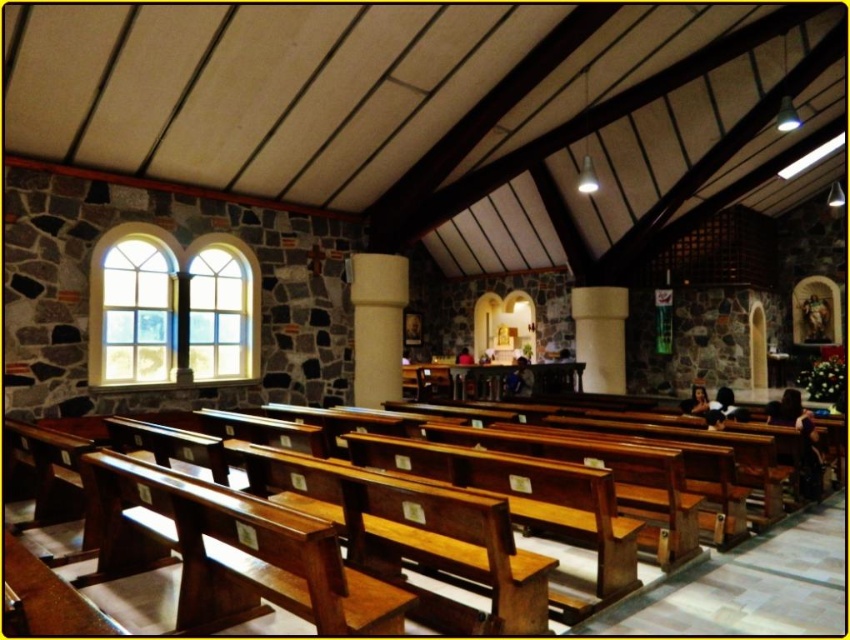
You are an interior designer planning to place a new sculpture in the church. You need to choose between placing it on the wooden bench at center or the white smooth column at center. Which location has more space available for the sculpture?

The white smooth column at center has more space available for the sculpture because the wooden bench at center occupies less space than the white smooth column at center.

You are an architect designing a new lighting system for the church. You need to determine if the wooden bench at center can be illuminated by the clear glass window at upper left. The minimum distance for effective illumination is 18 feet. Can the bench be sufficiently lit?

The wooden bench at center is 18.11 feet from the clear glass window at upper left. Since the required distance is 18 feet, the bench is just beyond the effective range and may not be sufficiently lit.

You are an interior designer planning to place a new decorative item in the church. You have a large sculpture that requires a space wider than the clear glass window at upper left. Can the wooden bench at center accommodate the sculpture?

The wooden bench at center has a width larger than the clear glass window at upper left, so it can accommodate the sculpture.